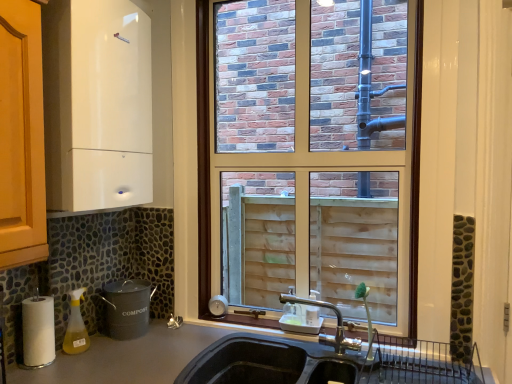
Question: Is smooth gray countertop at lower left next to white glossy boiler at upper left, marked as the 3th appliance in a bottom-to-top arrangement, and touching it?

Choices:
 (A) no
 (B) yes

Answer: (A)

Question: Can you confirm if smooth gray countertop at lower left is thinner than white glossy boiler at upper left, the first appliance when ordered from top to bottom?

Choices:
 (A) yes
 (B) no

Answer: (B)

Question: From the image's perspective, does smooth gray countertop at lower left appear higher than white glossy boiler at upper left, the first appliance when ordered from top to bottom?

Choices:
 (A) no
 (B) yes

Answer: (A)

Question: Is smooth gray countertop at lower left facing towards white glossy boiler at upper left, marked as the 3th appliance in a bottom-to-top arrangement?

Choices:
 (A) yes
 (B) no

Answer: (B)

Question: Does smooth gray countertop at lower left appear on the right side of white glossy boiler at upper left, the first appliance when ordered from top to bottom?

Choices:
 (A) no
 (B) yes

Answer: (B)

Question: From their relative heights in the image, would you say gold metallic faucet at center is taller or shorter than smooth gray countertop at lower left?

Choices:
 (A) tall
 (B) short

Answer: (B)

Question: Relative to smooth gray countertop at lower left, is gold metallic faucet at center in front or behind?

Choices:
 (A) front
 (B) behind

Answer: (B)

Question: Choose the correct answer: Is gold metallic faucet at center inside smooth gray countertop at lower left or outside it?

Choices:
 (A) inside
 (B) outside

Answer: (B)

Question: Does point (326, 342) appear closer or farther from the camera than point (102, 354)?

Choices:
 (A) farther
 (B) closer

Answer: (A)

Question: From the image's perspective, is yellow translucent spray bottle at lower left above or below gold metallic faucet at center?

Choices:
 (A) above
 (B) below

Answer: (B)

Question: In the image, is yellow translucent spray bottle at lower left on the left side or the right side of gold metallic faucet at center?

Choices:
 (A) right
 (B) left

Answer: (B)

Question: In terms of width, does yellow translucent spray bottle at lower left look wider or thinner when compared to gold metallic faucet at center?

Choices:
 (A) wide
 (B) thin

Answer: (B)

Question: Does point (75, 299) appear closer or farther from the camera than point (314, 301)?

Choices:
 (A) closer
 (B) farther

Answer: (A)

Question: Considering their positions, is white glossy boiler at upper left, the first appliance when ordered from top to bottom, located in front of or behind gray matte compost bin at lower left, the 1th appliance positioned from the bottom?

Choices:
 (A) front
 (B) behind

Answer: (A)

Question: Considering the positions of white glossy boiler at upper left, marked as the 3th appliance in a bottom-to-top arrangement, and gray matte compost bin at lower left, the 1th appliance positioned from the bottom, in the image, is white glossy boiler at upper left, marked as the 3th appliance in a bottom-to-top arrangement, wider or thinner than gray matte compost bin at lower left, the 1th appliance positioned from the bottom,?

Choices:
 (A) wide
 (B) thin

Answer: (A)